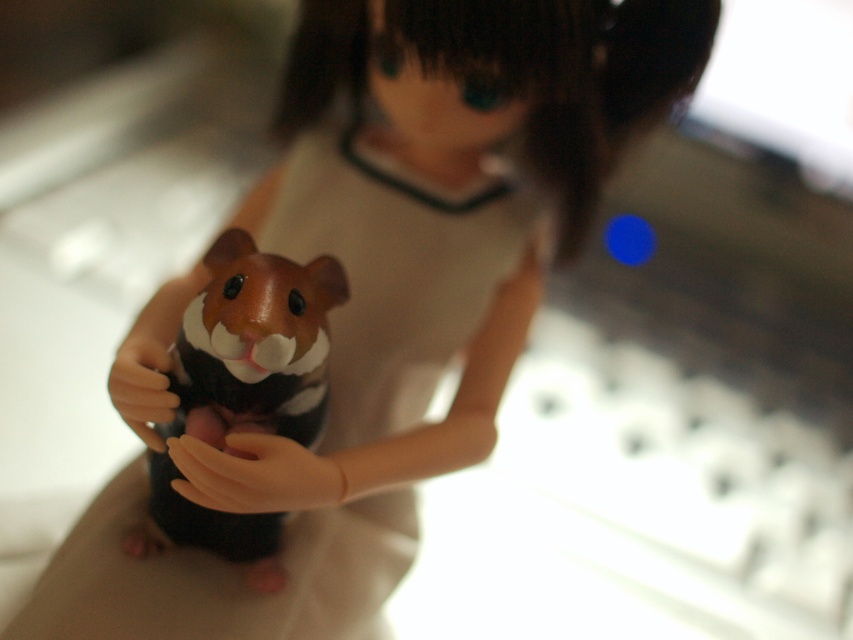
Based on the photo, does brown matte hamster at center have a lesser width compared to smooth beige hand at center?

No, brown matte hamster at center is not thinner than smooth beige hand at center.

Which of these two, brown matte hamster at center or smooth beige hand at center, stands shorter?

smooth beige hand at center is shorter.

Between point (238, 321) and point (234, 451), which one is positioned behind?

Point (234, 451)

This screenshot has width=853, height=640. What are the coordinates of `brown matte hamster at center` in the screenshot? It's located at (254, 346).